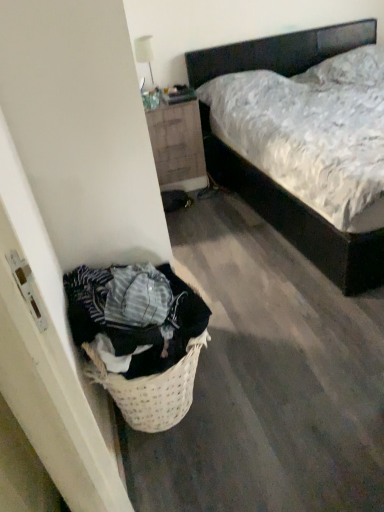
The image size is (384, 512). What do you see at coordinates (298, 220) in the screenshot?
I see `dark wood bed at center` at bounding box center [298, 220].

The image size is (384, 512). Identify the location of dark wood bed at center. (298, 220).

Locate an element on the screen. wooden nightstand at upper center is located at coordinates tap(178, 145).

What do you see at coordinates (178, 145) in the screenshot?
I see `wooden nightstand at upper center` at bounding box center [178, 145].

Locate an element on the screen. Image resolution: width=384 pixels, height=512 pixels. dark wood bed at center is located at coordinates (298, 220).

Consider the image. Is wooden nightstand at upper center to the left of dark wood bed at center from the viewer's perspective?

Indeed, wooden nightstand at upper center is positioned on the left side of dark wood bed at center.

Is wooden nightstand at upper center in front of or behind dark wood bed at center in the image?

Clearly, wooden nightstand at upper center is behind dark wood bed at center.

Which point is more forward, (165, 147) or (350, 282)?

The point (350, 282) is in front.

From the image's perspective, is wooden nightstand at upper center on top of dark wood bed at center?

Incorrect, from the image's perspective, wooden nightstand at upper center is lower than dark wood bed at center.

From a real-world perspective, is wooden nightstand at upper center physically located above or below dark wood bed at center?

Clearly, from a real-world perspective, wooden nightstand at upper center is below dark wood bed at center.

Does wooden nightstand at upper center have a lesser width compared to dark wood bed at center?

Correct, the width of wooden nightstand at upper center is less than that of dark wood bed at center.

Does wooden nightstand at upper center have a greater height compared to dark wood bed at center?

Incorrect, the height of wooden nightstand at upper center is not larger of that of dark wood bed at center.

Can you confirm if wooden nightstand at upper center is smaller than dark wood bed at center?

Indeed, wooden nightstand at upper center has a smaller size compared to dark wood bed at center.

Can we say wooden nightstand at upper center lies outside dark wood bed at center?

That's correct, wooden nightstand at upper center is outside of dark wood bed at center.

Looking at this image, is wooden nightstand at upper center next to dark wood bed at center?

No, wooden nightstand at upper center is not making contact with dark wood bed at center.

Is wooden nightstand at upper center oriented towards dark wood bed at center?

No, wooden nightstand at upper center is not oriented towards dark wood bed at center.

How far apart are wooden nightstand at upper center and dark wood bed at center?

wooden nightstand at upper center is 11.51 inches away from dark wood bed at center.

You are a GUI agent. You are given a task and a screenshot of the screen. Output one action in this format:
    pyautogui.click(x=<x>, y=<y>)
    Task: Click on the nightstand behind the dark wood bed at center
    
    Given the screenshot: What is the action you would take?
    pyautogui.click(x=178, y=145)

Considering the positions of objects dark wood bed at center and wooden nightstand at upper center in the image provided, who is more to the left, dark wood bed at center or wooden nightstand at upper center?

wooden nightstand at upper center is more to the left.

Does dark wood bed at center come in front of wooden nightstand at upper center?

Yes, dark wood bed at center is closer to the viewer.

Which is behind, point (267, 52) or point (166, 163)?

The point (267, 52) is farther from the camera.

From the image's perspective, is dark wood bed at center above or below wooden nightstand at upper center?

Clearly, from the image's perspective, dark wood bed at center is above wooden nightstand at upper center.

From a real-world perspective, is dark wood bed at center positioned above or below wooden nightstand at upper center?

From a real-world perspective, dark wood bed at center is physically above wooden nightstand at upper center.

Considering the relative sizes of dark wood bed at center and wooden nightstand at upper center in the image provided, is dark wood bed at center wider than wooden nightstand at upper center?

Correct, the width of dark wood bed at center exceeds that of wooden nightstand at upper center.

Between dark wood bed at center and wooden nightstand at upper center, which one has less height?

With less height is wooden nightstand at upper center.

Considering the relative sizes of dark wood bed at center and wooden nightstand at upper center in the image provided, is dark wood bed at center bigger than wooden nightstand at upper center?

Yes, dark wood bed at center is bigger than wooden nightstand at upper center.

Is dark wood bed at center positioned beyond the bounds of wooden nightstand at upper center?

Yes, dark wood bed at center is not within wooden nightstand at upper center.

Is dark wood bed at center with wooden nightstand at upper center?

No, dark wood bed at center is not with wooden nightstand at upper center.

Could you tell me if dark wood bed at center is facing wooden nightstand at upper center?

No, dark wood bed at center is not turned towards wooden nightstand at upper center.

Find the location of a particular element. This screenshot has width=384, height=512. nightstand located underneath the dark wood bed at center (from a real-world perspective) is located at coordinates (178, 145).

Identify the location of bed that appears above the wooden nightstand at upper center (from the image's perspective). The width and height of the screenshot is (384, 512). (298, 220).

Image resolution: width=384 pixels, height=512 pixels. I want to click on bed lying on the right of wooden nightstand at upper center, so click(x=298, y=220).